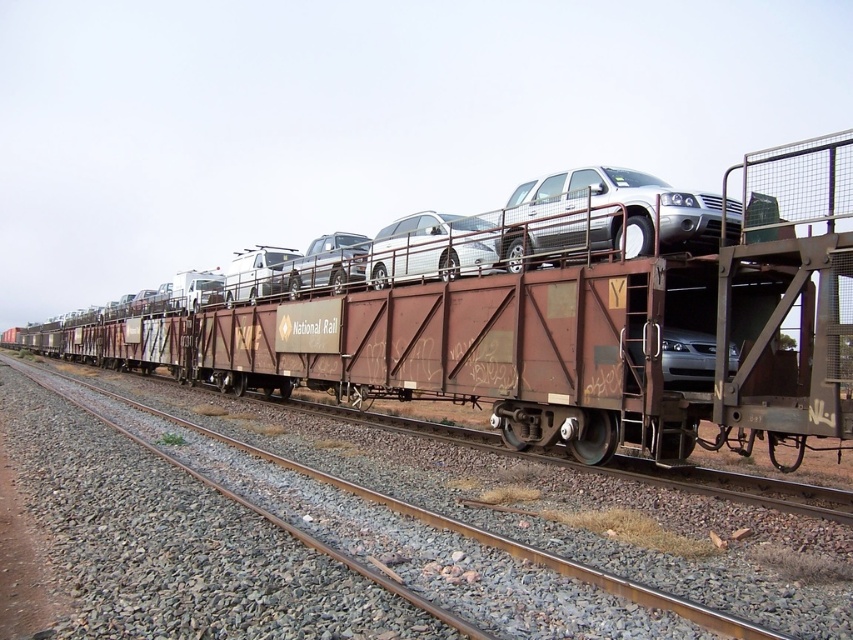
You are a delivery person trying to locate your package on a freight train. You see the rusty metal train car at center and the silver metallic suv at upper center. Which object is positioned to the left of the other?

The rusty metal train car at center is to the left of the silver metallic suv at upper center according to the description.